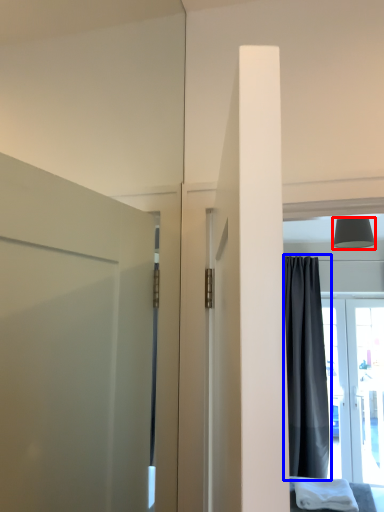
Question: Which object is further to the camera taking this photo, lamp (highlighted by a red box) or curtain (highlighted by a blue box)?

Choices:
 (A) lamp
 (B) curtain

Answer: (B)